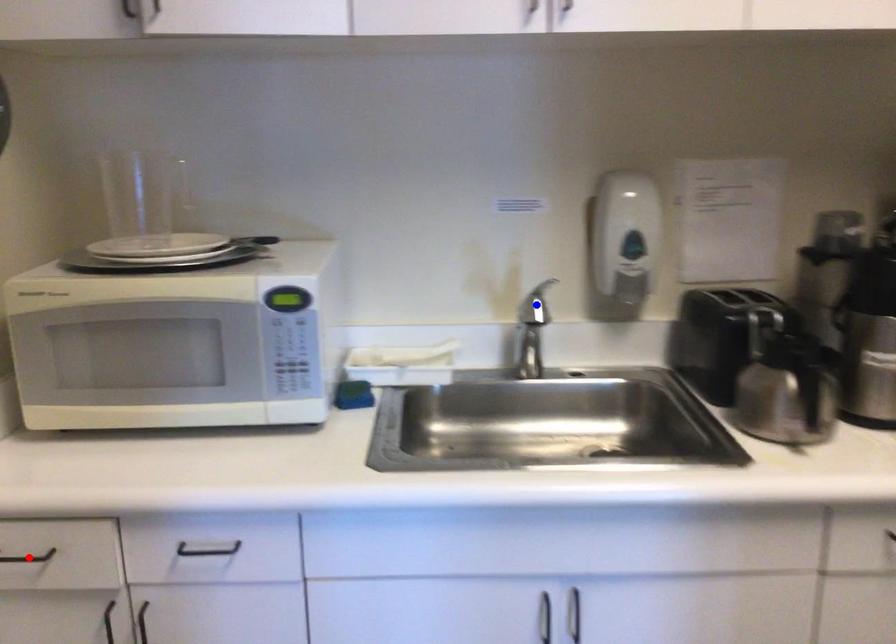
Question: In the image, two points are highlighted. Which point is nearer to the camera? Reply with the corresponding letter.

Choices:
 (A) blue point
 (B) red point

Answer: (B)